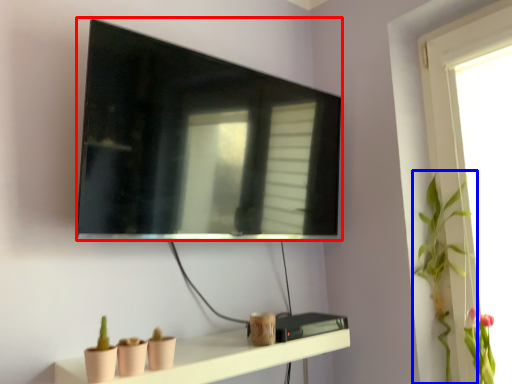
Question: Which object is closer to the camera taking this photo, television (highlighted by a red box) or plant (highlighted by a blue box)?

Choices:
 (A) television
 (B) plant

Answer: (A)